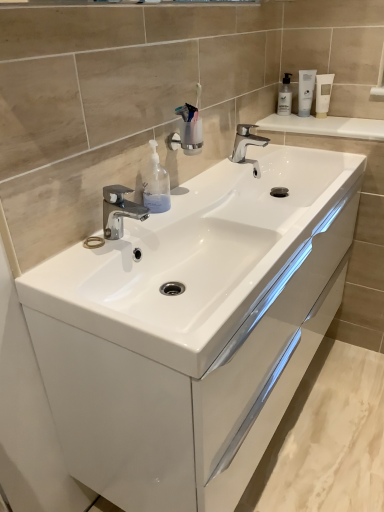
At what (x,y) coordinates should I click in order to perform the action: click on free spot to the left of polished chrome tap at center, placed as the first tap when sorted from front to back. Please return your answer as a coordinate pair (x, y). Looking at the image, I should click on (72, 256).